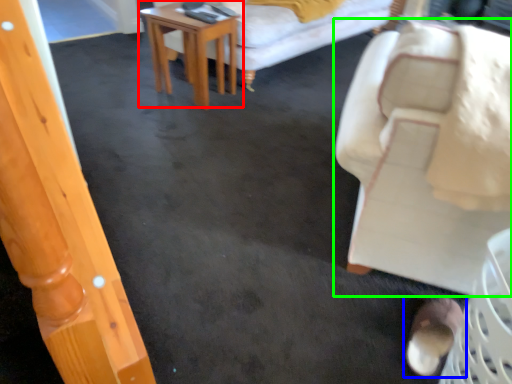
Question: Based on their relative distances, which object is nearer to table (highlighted by a red box)? Choose from footwear (highlighted by a blue box) and chair (highlighted by a green box).

Choices:
 (A) footwear
 (B) chair

Answer: (B)